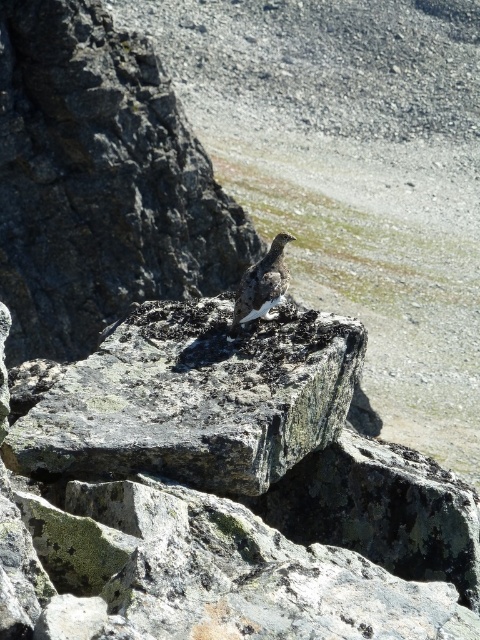
Question: Does rough gray rock at center appear under white speckled rock at center?

Choices:
 (A) no
 (B) yes

Answer: (A)

Question: Is gray rough rock at center smaller than white speckled rock at center?

Choices:
 (A) yes
 (B) no

Answer: (B)

Question: In this image, where is gray rough rock at center located relative to white speckled rock at center?

Choices:
 (A) above
 (B) below

Answer: (B)

Question: Based on their relative distances, which object is nearer to the rough gray rock at center?

Choices:
 (A) gray rough rock at center
 (B) white speckled rock at center

Answer: (B)

Question: Which of the following is the farthest from the observer?

Choices:
 (A) white speckled rock at center
 (B) rough gray rock at center
 (C) gray rough rock at center

Answer: (B)

Question: Among these points, which one is farthest from the camera?

Choices:
 (A) (194, 332)
 (B) (169, 298)

Answer: (B)